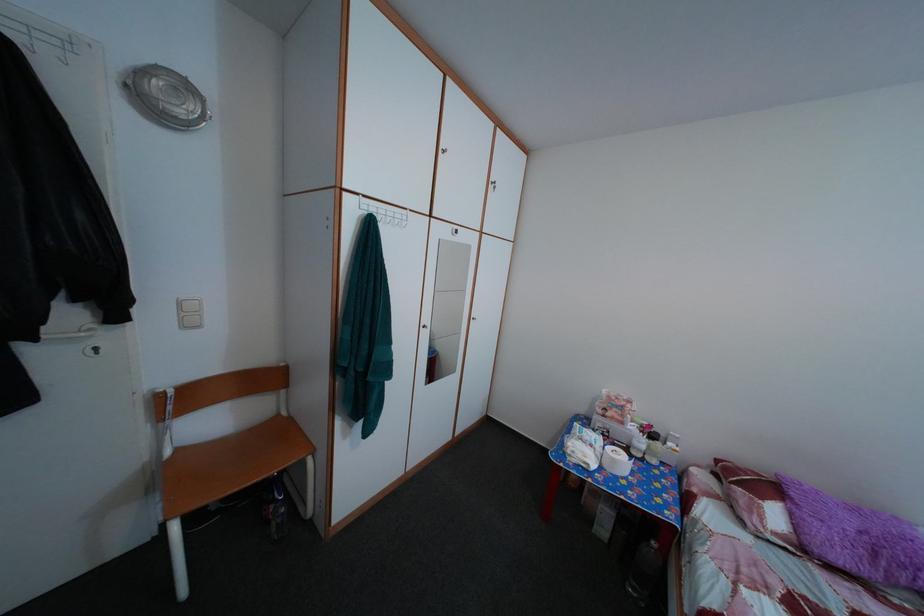
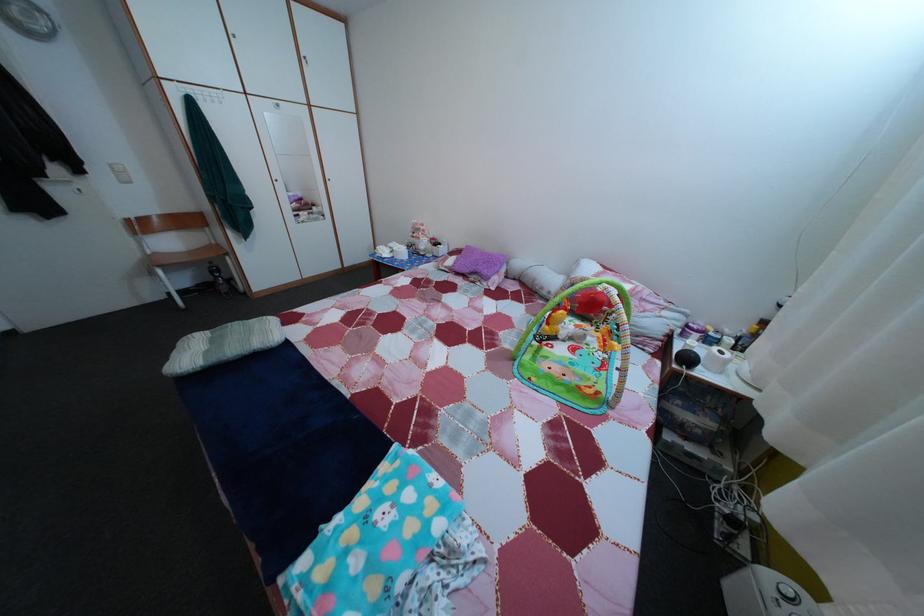
Where in the second image is the point corresponding to the point at 188,456 from the first image?

(164, 261)